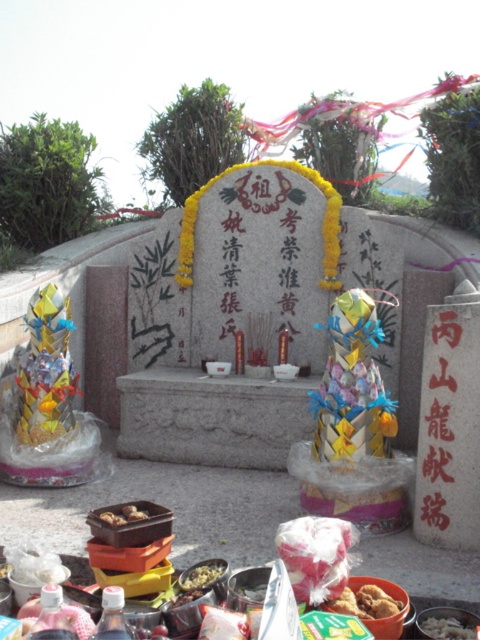
Question: Which object appears farthest from the camera in this image?

Choices:
 (A) shiny plastic container at center
 (B) shiny metallic bowl at lower center
 (C) shiny metallic bowl at center

Answer: (A)

Question: Can you confirm if brown crispy fried food at center is positioned to the right of shiny plastic container at center?

Choices:
 (A) no
 (B) yes

Answer: (B)

Question: Which of the following is the closest to the observer?

Choices:
 (A) brown crispy fried food at center
 (B) shiny metallic toy at left

Answer: (A)

Question: Is shiny metallic toy at left positioned before brown matte food at center?

Choices:
 (A) no
 (B) yes

Answer: (A)

Question: Which point appears farthest from the camera in this image?

Choices:
 (A) (40, 419)
 (B) (225, 564)
 (C) (131, 518)
 (D) (424, 620)

Answer: (A)

Question: Does shiny metallic toy at left appear on the left side of shiny plastic container at center?

Choices:
 (A) yes
 (B) no

Answer: (A)